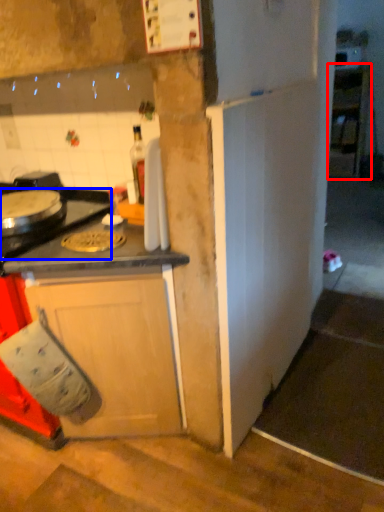
Question: Which object appears closest to the camera in this image, cabinetry (highlighted by a red box) or gas stove (highlighted by a blue box)?

Choices:
 (A) cabinetry
 (B) gas stove

Answer: (B)